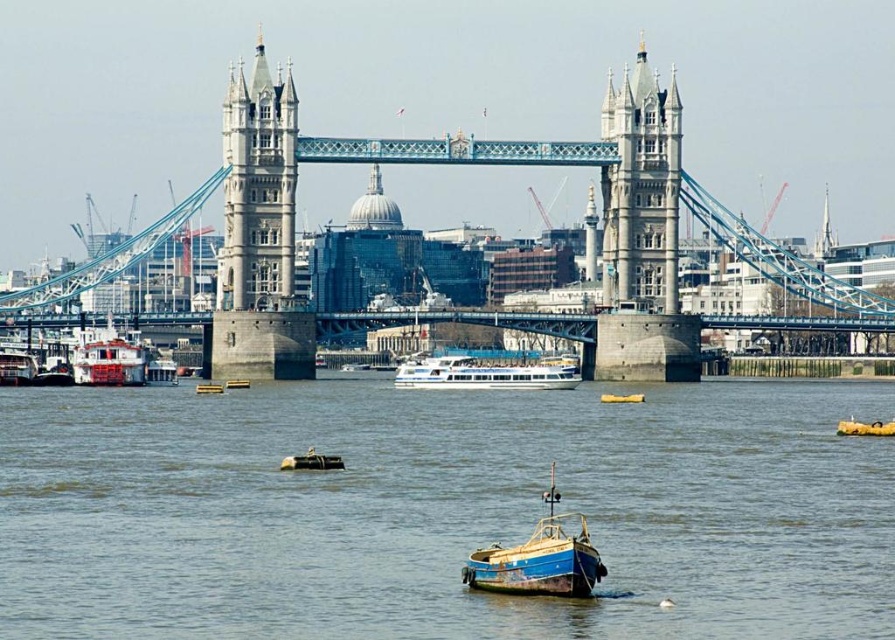
Question: Is the position of white glossy ferry at center less distant than that of yellow plastic boat at center?

Choices:
 (A) yes
 (B) no

Answer: (B)

Question: Which point appears closest to the camera in this image?

Choices:
 (A) (473, 376)
 (B) (295, 460)
 (C) (631, 396)

Answer: (B)

Question: Which of the following is the farthest from the observer?

Choices:
 (A) white glossy ferry at center
 (B) yellow rubber boat at lower right

Answer: (A)

Question: Is smooth brown water at center above yellow rubber boat at lower right?

Choices:
 (A) yes
 (B) no

Answer: (B)

Question: Which point is farther to the camera?

Choices:
 (A) yellow rubber boat at lower right
 (B) metallic blue boat at center
 (C) blue wooden boat at center
 (D) yellow plastic boat at center

Answer: (D)

Question: Is smooth brown water at center thinner than white glossy ferry at center?

Choices:
 (A) no
 (B) yes

Answer: (A)